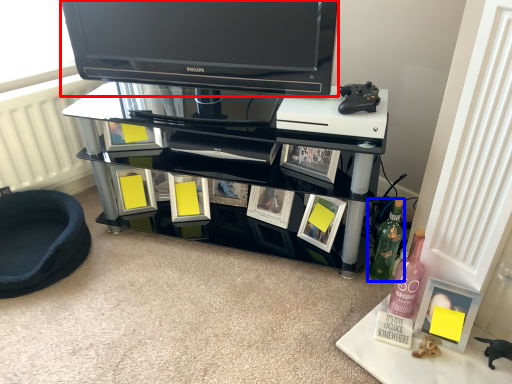
Question: Which of the following is the farthest to the observer, television (highlighted by a red box) or bottle (highlighted by a blue box)?

Choices:
 (A) television
 (B) bottle

Answer: (B)